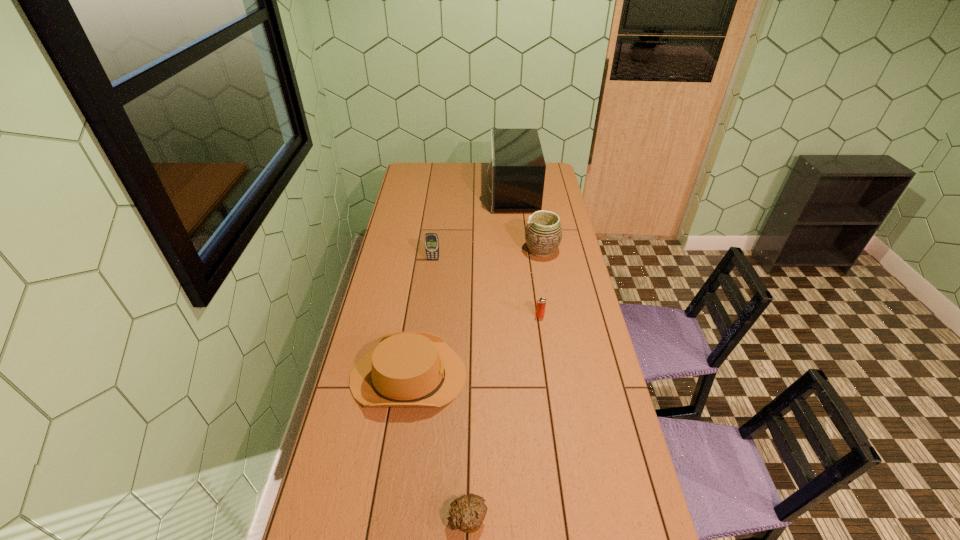
Locate an element on the screen. The image size is (960, 540). blank area located with the door open on the farthest object is located at coordinates (442, 192).

Locate an element on the screen. This screenshot has height=540, width=960. vacant space located with the door open on the farthest object is located at coordinates (452, 192).

Locate an element on the screen. This screenshot has height=540, width=960. vacant region located with the door open on the farthest object is located at coordinates pos(475,192).

You are a GUI agent. You are given a task and a screenshot of the screen. Output one action in this format:
    pyautogui.click(x=<x>, y=<y>)
    Task: Click on the vacant space located on the front of the pottery
    
    Given the screenshot: What is the action you would take?
    pyautogui.click(x=546, y=276)

I want to click on free region located 0.280m on the screen of the fourth shortest object, so click(x=427, y=303).

At what (x,y) coordinates should I click in order to perform the action: click on free region located 0.130m on the front-facing side of the second nearest object. Please return your answer as a coordinate pair (x, y). The height and width of the screenshot is (540, 960). Looking at the image, I should click on (504, 376).

Find the location of a particular element. This screenshot has width=960, height=540. vacant region located 0.320m on the left of the igniter is located at coordinates (455, 316).

This screenshot has height=540, width=960. I want to click on vacant space positioned on the back of the nearest object, so click(469, 462).

Where is `object that is at the far edge`? The image size is (960, 540). object that is at the far edge is located at coordinates (517, 167).

Locate an element on the screen. The image size is (960, 540). object at the left edge is located at coordinates 405,369.